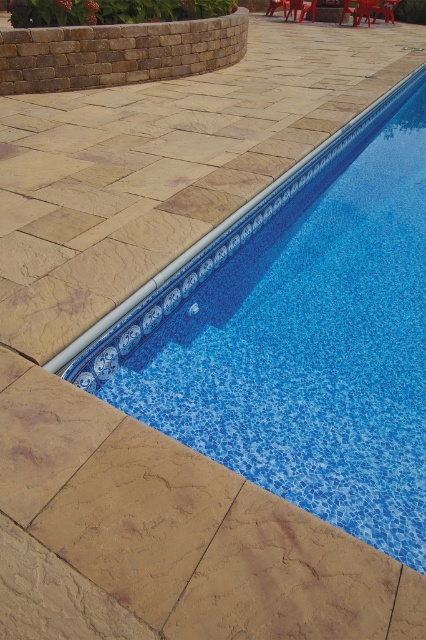
You are standing at the center of the stone patio and want to place a new potted plant. The potted plant needs to be placed at the exact location where the matte plastic chair at upper right is currently located. Is this possible?

The matte plastic chair at upper right is located at point 2D coordinates of [385,8]. Since the chair is already occupying that spot, you cannot place the potted plant there unless you move the chair first.